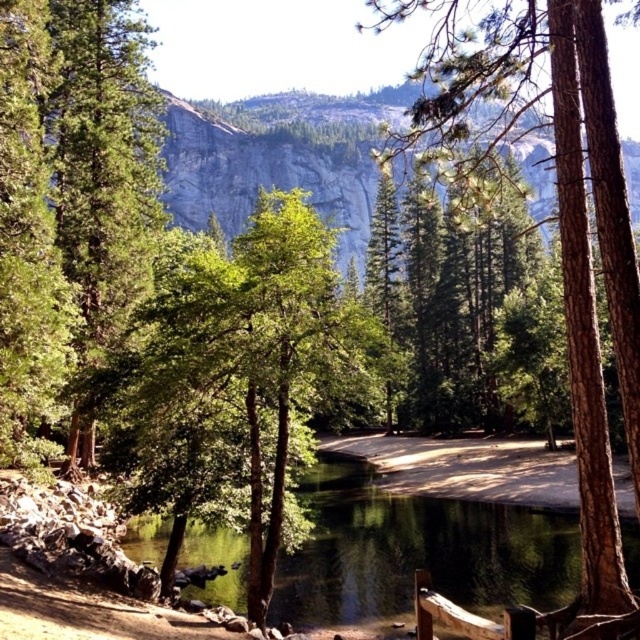
What do you see at coordinates (417, 550) in the screenshot? I see `green reflective water at center` at bounding box center [417, 550].

The image size is (640, 640). What are the coordinates of `green reflective water at center` in the screenshot? It's located at (x=417, y=550).

Is green textured tree at center above green textured tree at left?

Correct, green textured tree at center is located above green textured tree at left.

Is point (628, 234) positioned after point (8, 275)?

No, (628, 234) is closer to viewer.

Identify the location of green textured tree at center. This screenshot has height=640, width=640. (561, 248).

Is green textured tree at center wider than green reflective water at center?

No.

Between green textured tree at center and green reflective water at center, which one is positioned lower?

green reflective water at center is lower down.

Is point (566, 150) closer to camera compared to point (492, 573)?

Yes, it is.

At what (x,y) coordinates should I click in order to perform the action: click on green textured tree at center. Please return your answer as a coordinate pair (x, y). Looking at the image, I should click on (561, 248).